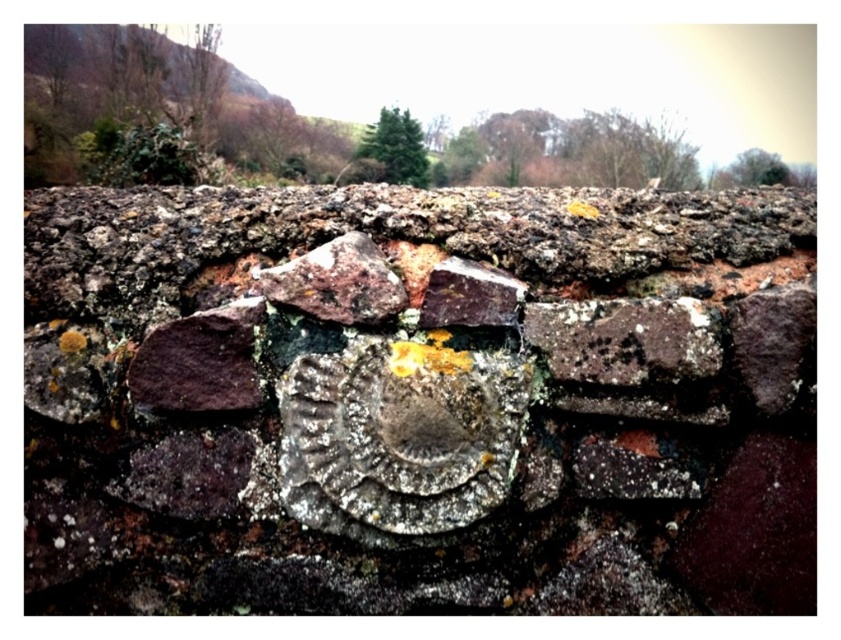
From the picture: You are an archaeologist examining the stone wall. You notice the rusty stone plaque at center and the purple stone at left. Which object is wider?

The rusty stone plaque at center might be wider than purple stone at left.